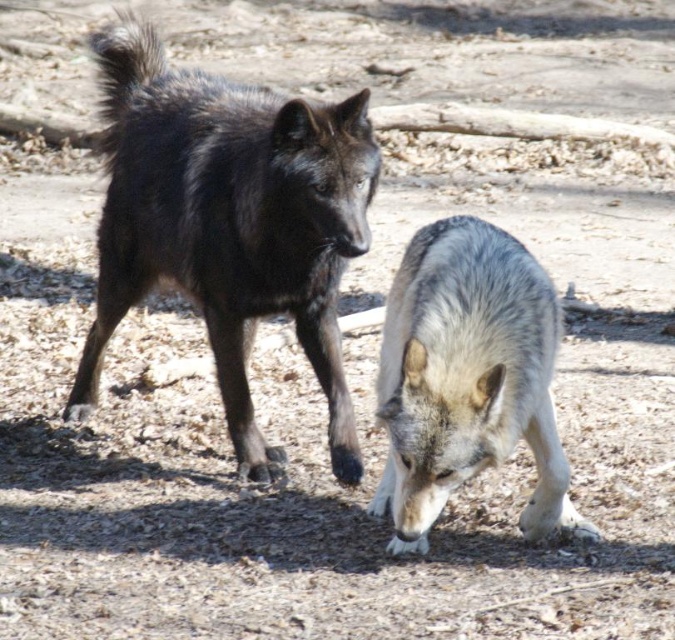
Which is below, shiny black fur at center or gray fur wolf at lower center?

Positioned lower is gray fur wolf at lower center.

Who is higher up, shiny black fur at center or gray fur wolf at lower center?

shiny black fur at center is above.

Find the location of a particular element. The image size is (675, 640). shiny black fur at center is located at coordinates (227, 224).